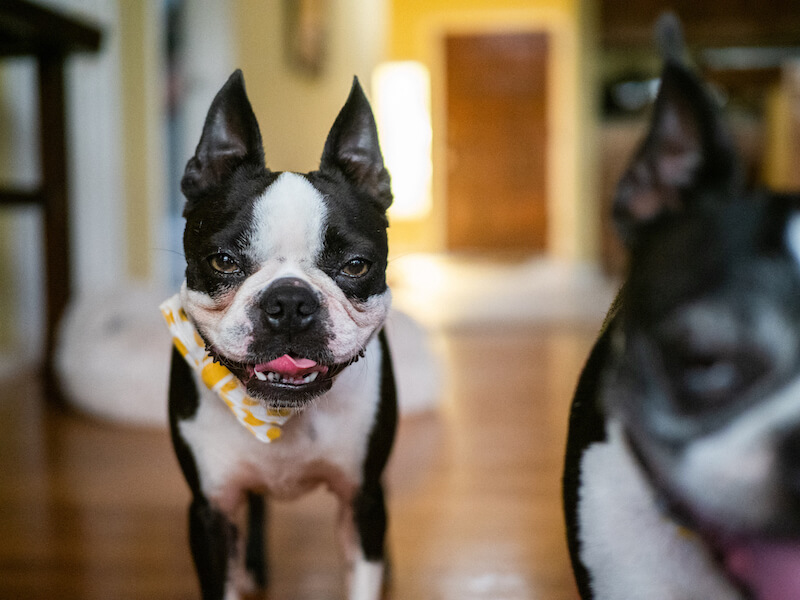
The width and height of the screenshot is (800, 600). What are the coordinates of `desk` in the screenshot? It's located at (28, 22), (56, 251), (54, 202).